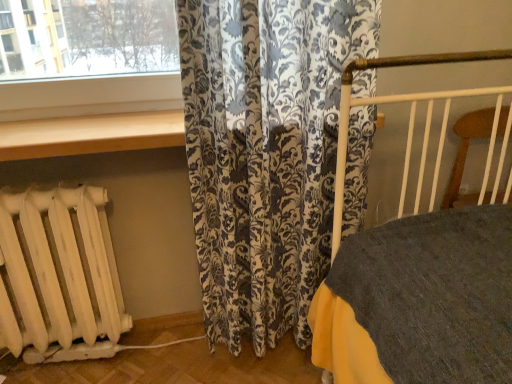
The image size is (512, 384). What do you see at coordinates (91, 134) in the screenshot? I see `wooden at upper center` at bounding box center [91, 134].

Measure the distance between point [88,330] and camera.

The distance of point [88,330] from camera is 4.75 feet.

At what (x,y) coordinates should I click in order to perform the action: click on wooden at upper center. Please return your answer as a coordinate pair (x, y). The height and width of the screenshot is (384, 512). Looking at the image, I should click on (91, 134).

In the scene shown: Is floral-patterned fabric at center taller or shorter than white matte radiator at lower left?

floral-patterned fabric at center is taller than white matte radiator at lower left.

Considering the points (224, 210) and (14, 338), which point is in front, point (224, 210) or point (14, 338)?

The point (224, 210) is in front.

Considering the sizes of floral-patterned fabric at center and white matte radiator at lower left in the image, is floral-patterned fabric at center wider or thinner than white matte radiator at lower left?

Clearly, floral-patterned fabric at center has more width compared to white matte radiator at lower left.

In the scene shown: From a real-world perspective, who is located lower, white matte radiator at lower left or floral-patterned fabric at center?

white matte radiator at lower left is physically lower.

In the scene shown: Is white matte radiator at lower left facing away from floral-patterned fabric at center?

That's not correct — white matte radiator at lower left is not looking away from floral-patterned fabric at center.

How different are the orientations of white matte radiator at lower left and floral-patterned fabric at center in degrees?

They differ by 2.9 degrees in their facing directions.

Can you confirm if white matte radiator at lower left is smaller than floral-patterned fabric at center?

Correct, white matte radiator at lower left occupies less space than floral-patterned fabric at center.

From the image's perspective, which one is positioned higher, wooden at upper center or floral-patterned fabric at center?

wooden at upper center.

Does point (67, 150) lie behind point (357, 174)?

No, it is not.

In the scene shown: Does wooden at upper center appear on the left side of floral-patterned fabric at center?

Indeed, wooden at upper center is positioned on the left side of floral-patterned fabric at center.

In the scene shown: Is wooden at upper center turned away from floral-patterned fabric at center?

Yes, floral-patterned fabric at center is at the back of wooden at upper center.

Considering the positions of objects floral-patterned fabric at center and wooden at upper center in the image provided, who is more to the left, floral-patterned fabric at center or wooden at upper center?

wooden at upper center.

Choose the correct answer: Is floral-patterned fabric at center inside wooden at upper center or outside it?

floral-patterned fabric at center is outside wooden at upper center.

Which object is further away from the camera taking this photo, floral-patterned fabric at center or wooden at upper center?

wooden at upper center is further from the camera.

Is floral-patterned fabric at center taller than wooden at upper center?

Indeed, floral-patterned fabric at center has a greater height compared to wooden at upper center.

Looking at this image, from a real-world perspective, is wooden at upper center on top of white matte radiator at lower left?

Yes, from a real-world perspective, wooden at upper center is over white matte radiator at lower left

Would you say wooden at upper center is a long distance from white matte radiator at lower left?

wooden at upper center is near white matte radiator at lower left, not far away.

Can you tell me how much white matte radiator at lower left and wooden at upper center differ in facing direction?

The facing directions of white matte radiator at lower left and wooden at upper center are 0.367 degrees apart.

Considering the sizes of objects white matte radiator at lower left and wooden at upper center in the image provided, who is thinner, white matte radiator at lower left or wooden at upper center?

With smaller width is white matte radiator at lower left.

What are the coordinates of `window sill above the white matte radiator at lower left (from the image's perspective)` in the screenshot? It's located at (91, 134).

The image size is (512, 384). In order to click on radiator below the floral-patterned fabric at center (from a real-world perspective) in this screenshot , I will do `click(59, 275)`.

Identify the location of curtain above the white matte radiator at lower left (from a real-world perspective). (265, 153).

In the scene shown: Which object lies further to the anchor point floral-patterned fabric at center, white matte radiator at lower left or wooden at upper center?

white matte radiator at lower left.

In the scene shown: From the image, which object appears to be farther from white matte radiator at lower left, wooden at upper center or floral-patterned fabric at center?

Among the two, floral-patterned fabric at center is located further to white matte radiator at lower left.

Looking at this image, estimate the real-world distances between objects in this image. Which object is further from wooden at upper center, white matte radiator at lower left or floral-patterned fabric at center?

white matte radiator at lower left is positioned further to the anchor wooden at upper center.

In the scene shown: Considering their positions, is floral-patterned fabric at center positioned closer to white matte radiator at lower left than wooden at upper center?

Among the two, wooden at upper center is located nearer to white matte radiator at lower left.

Estimate the real-world distances between objects in this image. Which object is closer to wooden at upper center, floral-patterned fabric at center or white matte radiator at lower left?

floral-patterned fabric at center is closer to wooden at upper center.

Estimate the real-world distances between objects in this image. Which object is further from floral-patterned fabric at center, wooden at upper center or white matte radiator at lower left?

white matte radiator at lower left lies further to floral-patterned fabric at center than the other object.

Identify the location of window sill between white matte radiator at lower left and floral-patterned fabric at center in the horizontal direction. The width and height of the screenshot is (512, 384). (91, 134).